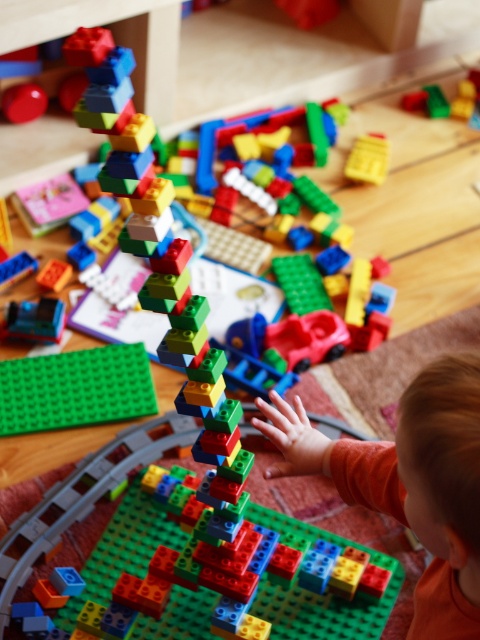
You are a parent who wants to place a small toy car between the orange soft baby at center and the green matte baseplate at center. Since the baseplate is flat on the floor, where should you place the toy car?

The orange soft baby at center is much taller than the green matte baseplate at center, so you should place the toy car near the base of the orange soft baby at center to ensure it stays visible and within reach.